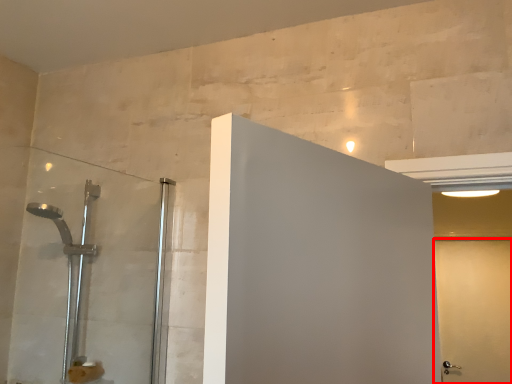
Question: From the image's perspective, where is screen door (annotated by the red box) located relative to shower door?

Choices:
 (A) below
 (B) above

Answer: (A)